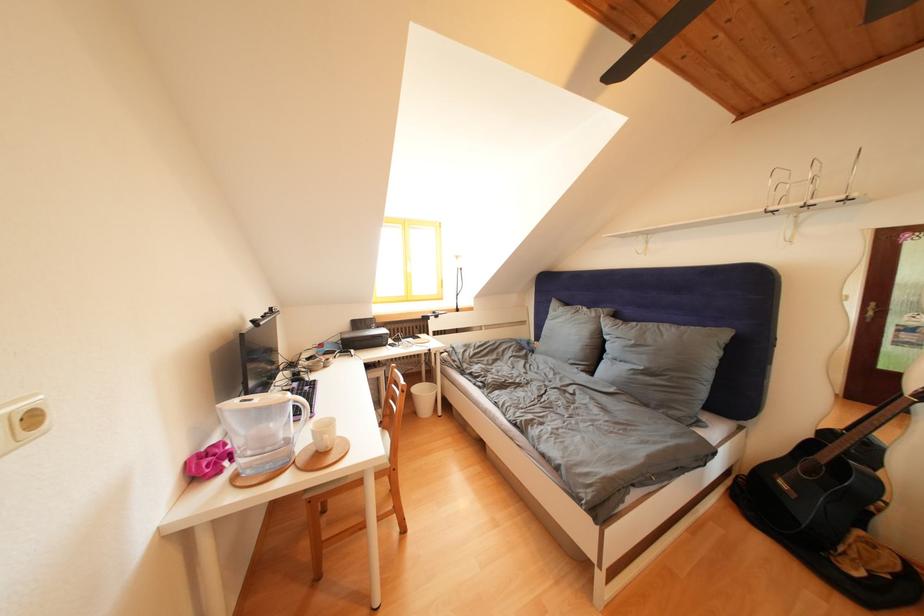
Find the location of a particular element. This screenshot has height=616, width=924. white power outlet is located at coordinates (22, 422).